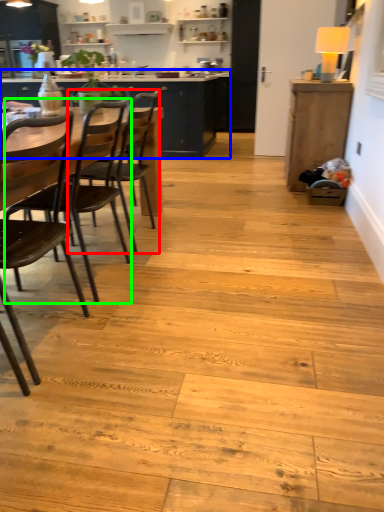
Question: Which object is positioned closest to chair (highlighted by a red box)? Select from cabinetry (highlighted by a blue box) and chair (highlighted by a green box).

Choices:
 (A) cabinetry
 (B) chair

Answer: (B)